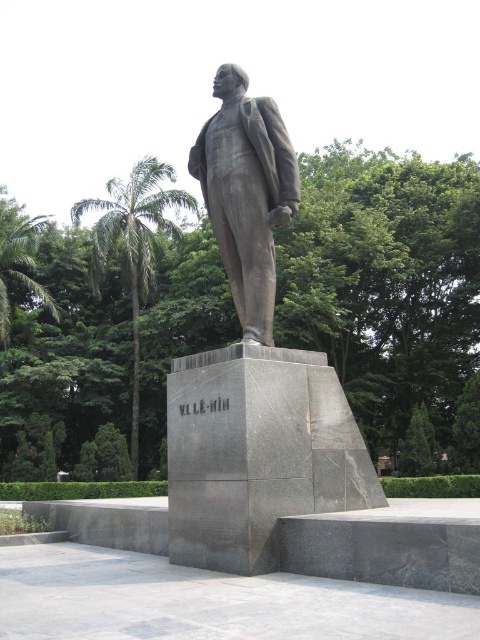
You are standing in front of the statue and want to take a photo. You notice two points on the statue marked at coordinates point (207,381) and point (254,285). Which point is closer to your camera when taking the photo?

Point (207,381) is closer to the camera than point (254,285).